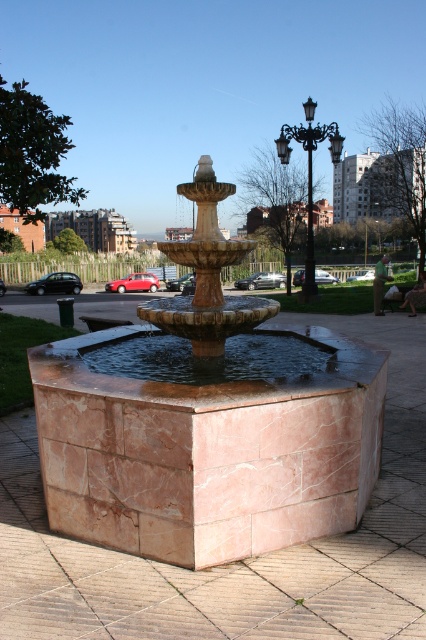
Question: Which point appears closest to the camera in this image?

Choices:
 (A) (178, 301)
 (B) (307, 372)
 (C) (78, 352)

Answer: (B)

Question: Can you confirm if clear glass water at center is positioned below black wrought iron streetlight at upper right?

Choices:
 (A) no
 (B) yes

Answer: (B)

Question: Among these objects, which one is nearest to the camera?

Choices:
 (A) black wrought iron streetlight at upper right
 (B) clear glass water at center

Answer: (B)

Question: Is pink marble fountain at center to the right of clear glass water at center from the viewer's perspective?

Choices:
 (A) yes
 (B) no

Answer: (A)

Question: Which of the following is the closest to the observer?

Choices:
 (A) (290, 138)
 (B) (140, 344)
 (C) (192, 301)

Answer: (C)

Question: Is pink marble fountain at center bigger than clear glass water at center?

Choices:
 (A) no
 (B) yes

Answer: (B)